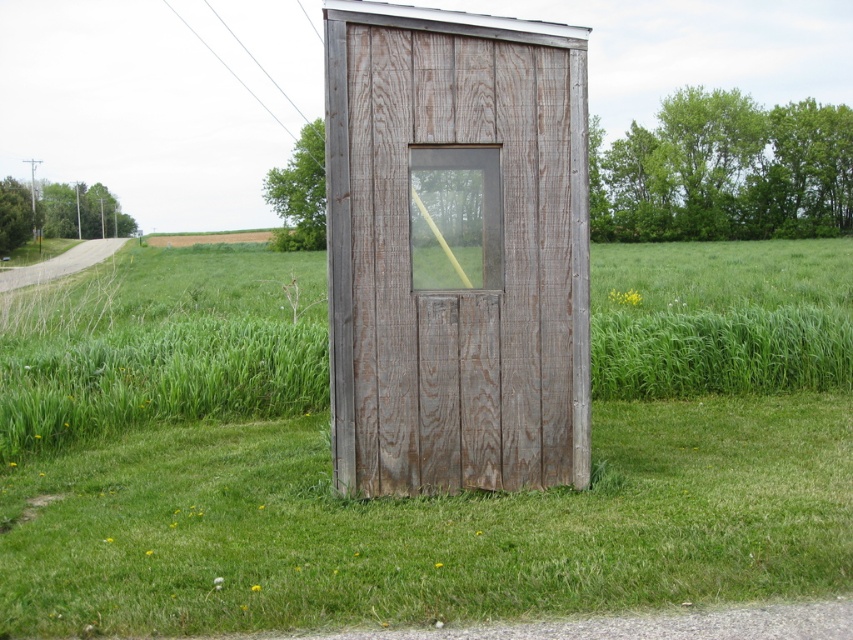
Question: Does weathered wood door at center have a lesser width compared to transparent plastic window at center?

Choices:
 (A) yes
 (B) no

Answer: (B)

Question: From the image, what is the correct spatial relationship of weathered wood door at center in relation to transparent plastic window at center?

Choices:
 (A) above
 (B) below

Answer: (B)

Question: Which of these objects is positioned closest to the weathered wood door at center?

Choices:
 (A) wooden shed at center
 (B) transparent plastic window at center

Answer: (B)

Question: Among these points, which one is farthest from the camera?

Choices:
 (A) pos(447,444)
 (B) pos(318,420)
 (C) pos(442,172)

Answer: (B)

Question: Which point is closer to the camera?

Choices:
 (A) transparent plastic window at center
 (B) weathered wood door at center
 (C) wooden shed at center
 (D) weathered wood hut at center

Answer: (C)

Question: In this image, where is wooden shed at center located relative to transparent plastic window at center?

Choices:
 (A) above
 (B) below

Answer: (B)